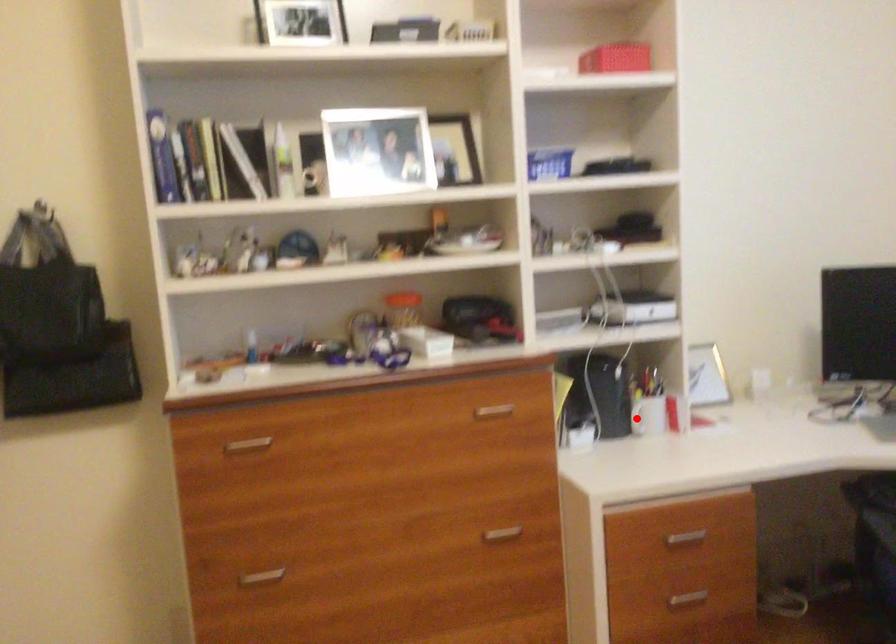
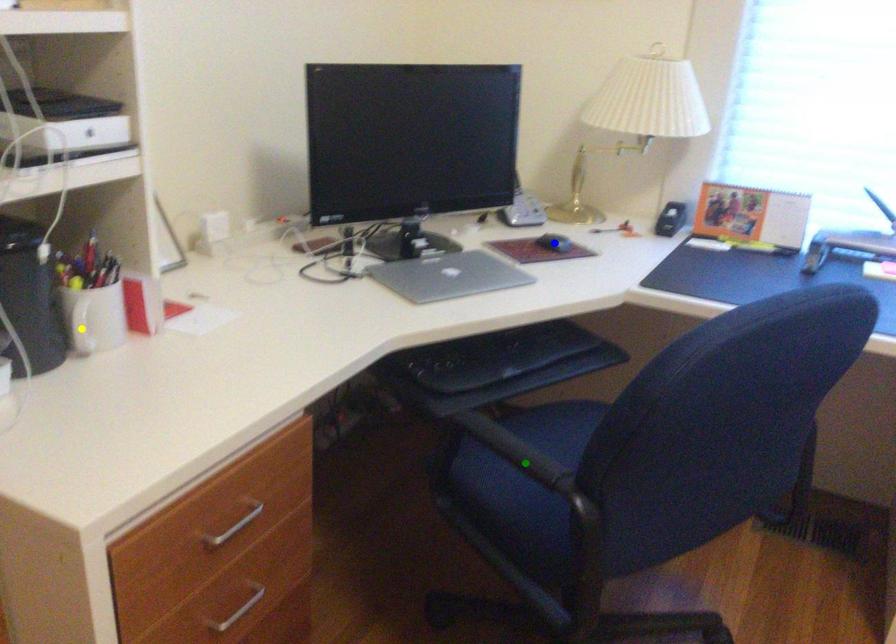
Question: I am providing you with two images of the same scene from different viewpoints. A red point is marked on the first image. You are given multiple points on the second image. Which point in image 2 represents the same 3d spot as the red point in image 1?

Choices:
 (A) blue point
 (B) yellow point
 (C) green point

Answer: (B)